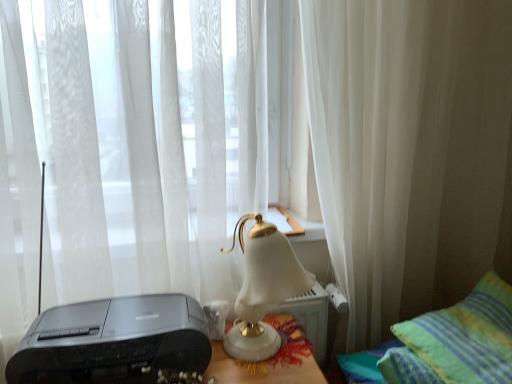
Question: Considering the positions of white sheer curtain at center, positioned as the 2th curtain in right-to-left order, and white porcelain lamp at center in the image, is white sheer curtain at center, positioned as the 2th curtain in right-to-left order, taller or shorter than white porcelain lamp at center?

Choices:
 (A) tall
 (B) short

Answer: (A)

Question: Is white sheer curtain at center, arranged as the 1th curtain when viewed from the left, inside the boundaries of white porcelain lamp at center, or outside?

Choices:
 (A) inside
 (B) outside

Answer: (B)

Question: Estimate the real-world distances between objects in this image. Which object is farther from the white sheer curtain at center, positioned as the 2th curtain in right-to-left order?

Choices:
 (A) white porcelain lamp at center
 (B) matte black printer at lower left
 (C) green striped pillow at lower right
 (D) white sheer curtain at center, the second curtain when ordered from left to right

Answer: (C)

Question: Which object is positioned closest to the matte black printer at lower left?

Choices:
 (A) white sheer curtain at center, arranged as the 1th curtain when viewed from the left
 (B) white porcelain lamp at center
 (C) green striped pillow at lower right
 (D) white sheer curtain at center, placed as the 1th curtain when sorted from right to left

Answer: (B)